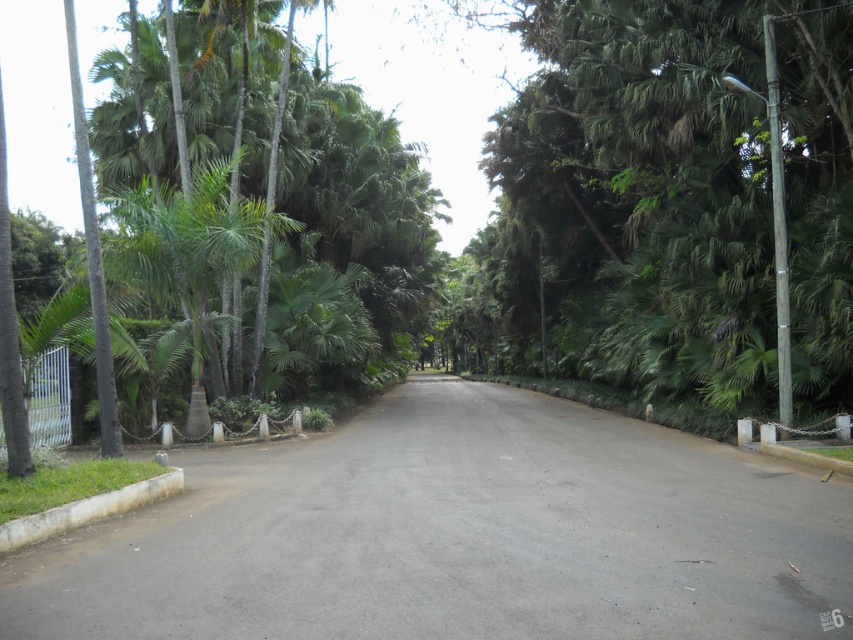
Question: Which point is closer to the camera?

Choices:
 (A) green leafy palm at left
 (B) green leafy tree at center

Answer: (A)

Question: Can you confirm if green leafy tree at center is positioned above green leafy palm at left?

Choices:
 (A) no
 (B) yes

Answer: (A)

Question: Does green leafy tree at center have a smaller size compared to green leafy palm at left?

Choices:
 (A) no
 (B) yes

Answer: (B)

Question: Considering the relative positions of green leafy tree at center and green leafy palm at left in the image provided, where is green leafy tree at center located with respect to green leafy palm at left?

Choices:
 (A) left
 (B) right

Answer: (B)

Question: Which point appears farthest from the camera in this image?

Choices:
 (A) (531, 161)
 (B) (152, 112)

Answer: (A)